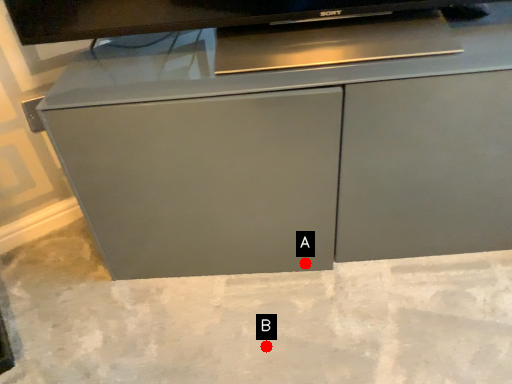
Question: Two points are circled on the image, labeled by A and B beside each circle. Which point is closer to the camera taking this photo?

Choices:
 (A) A is closer
 (B) B is closer

Answer: (B)